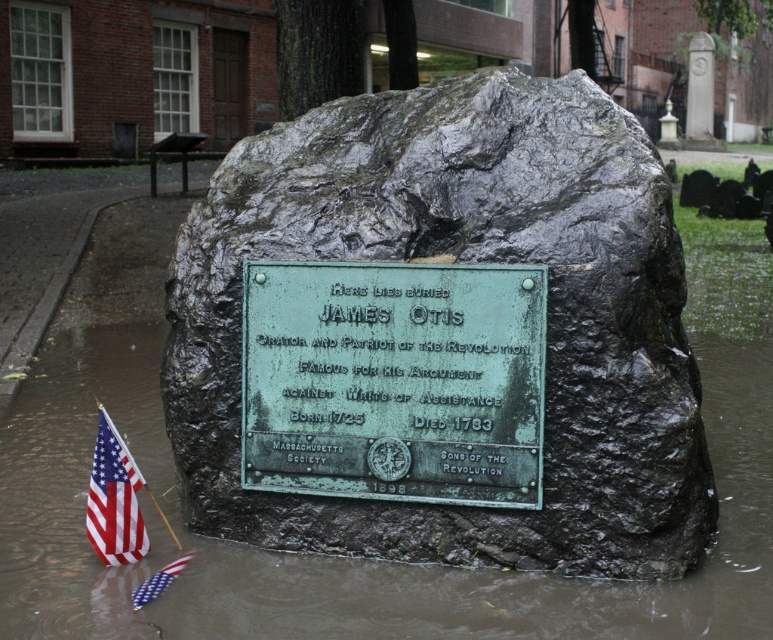
You are a tour guide leading a group to the burial site of James Otis. You need to ensure that visitors can easily see both the green patina plaque at center and the american flag fabric at lower left from their current position. Given that the average human eye can focus clearly on objects no farther than 60 centimeters apart when standing at a fixed distance, will visitors be able to view both items comfortably without moving their head?

The distance between the green patina plaque at center and the american flag fabric at lower left is 64.20 centimeters. Since this exceeds the 60 centimeter limit, visitors may have difficulty viewing both items comfortably without moving their head.

You are standing in front of the burial site of James Otis. You see the green patina stone boulder at center and the red fabric flag at lower left. Which object is closer to you?

The green patina stone boulder at center is closer to the viewer than the red fabric flag at lower left.